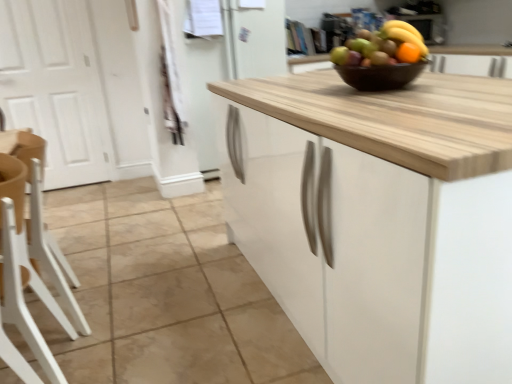
Find the location of a particular element. free point to the right of white matte door at left is located at coordinates (106, 193).